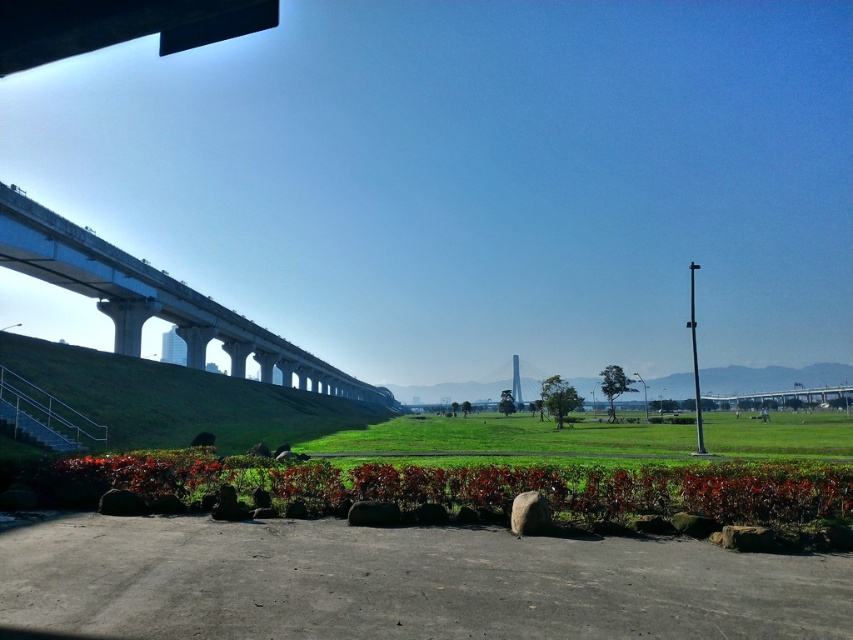
You are planning to place a 3m wide garden bench in this area. Based on the scene, which object from the green grassy hill at left and the white concrete pillar at center would allow the bench to fit next to it without overlapping?

The green grassy hill at left has a greater width than the white concrete pillar at center, so placing the bench next to the green grassy hill at left would provide enough space as its width is wider.

You are standing on the concrete bridge at left and want to walk towards the green grassy hill at left. Which direction should you face to reach the hill?

To reach the green grassy hill at left from the concrete bridge at left, you should face the right side since the green grassy hill at left is positioned on the right side of the concrete bridge at left.